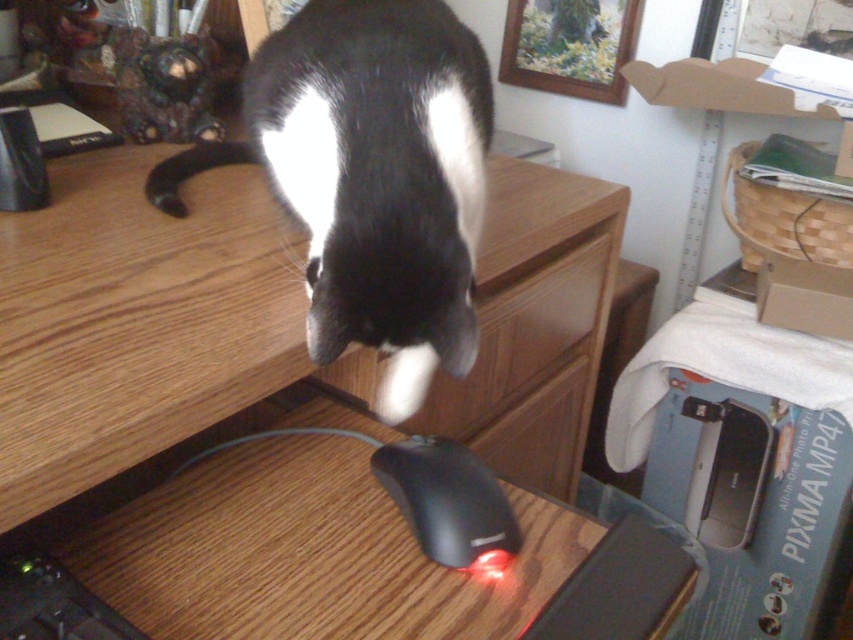
Question: Can you confirm if black fur cat at upper center is wider than wooden drawer at center?

Choices:
 (A) no
 (B) yes

Answer: (B)

Question: Which point appears farthest from the camera in this image?

Choices:
 (A) (389, 493)
 (B) (410, 246)

Answer: (A)

Question: Based on their relative distances, which object is nearer to the black fur cat at upper center?

Choices:
 (A) wooden at center
 (B) wooden drawer at center

Answer: (A)

Question: Among these points, which one is farthest from the camera?

Choices:
 (A) (294, 500)
 (B) (360, 369)
 (C) (444, 534)

Answer: (B)

Question: Observing the image, what is the correct spatial positioning of black fur cat at upper center in reference to black matte mouse at center?

Choices:
 (A) right
 (B) left

Answer: (B)

Question: Is wooden at center to the right of wooden drawer at center from the viewer's perspective?

Choices:
 (A) yes
 (B) no

Answer: (B)